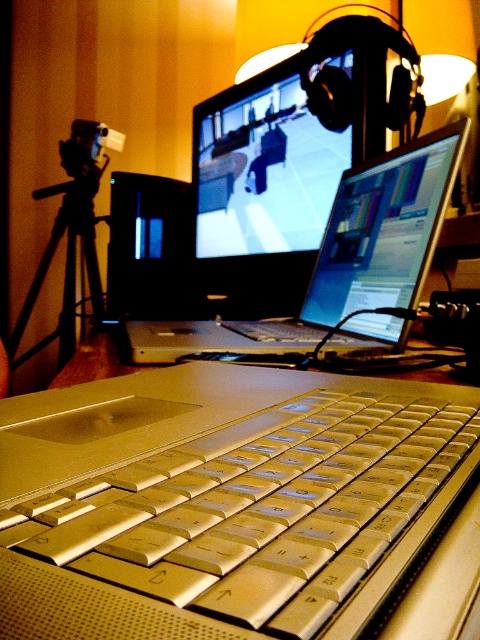
You are setting up a new monitor stand and need to place it between the silver metallic keyboard at center and the black matte tripod at left. Based on their positions, where should the monitor stand be placed?

The monitor stand should be placed above the silver metallic keyboard at center because it is located below the black matte tripod at left, so placing it above the keyboard would position it between the two objects.

You are standing in front of the workspace setup. There is a point at coordinates (340, 257). What object is located at this point?

The point at coordinates (340, 257) corresponds to the silver metallic laptop at center.

You are setting up a camera for a video call. The black matte tripod at left is placed 7.86 feet away from the camera. If the minimum recommended distance for optimal focus is 8 feet, will the camera be in focus?

The black matte tripod at left is placed 7.86 feet away from the camera, which is slightly less than the recommended 8 feet for optimal focus. Therefore, the camera may not be in focus.